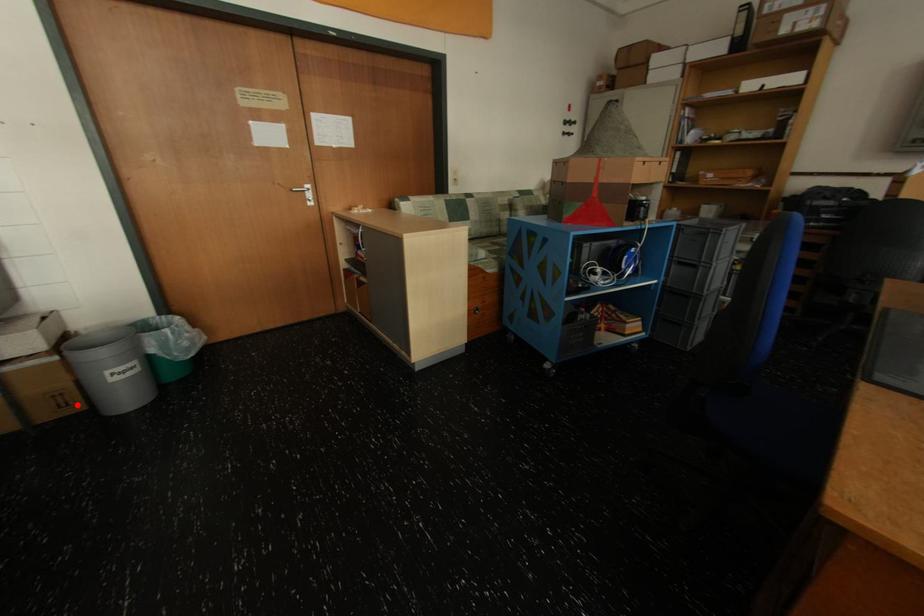
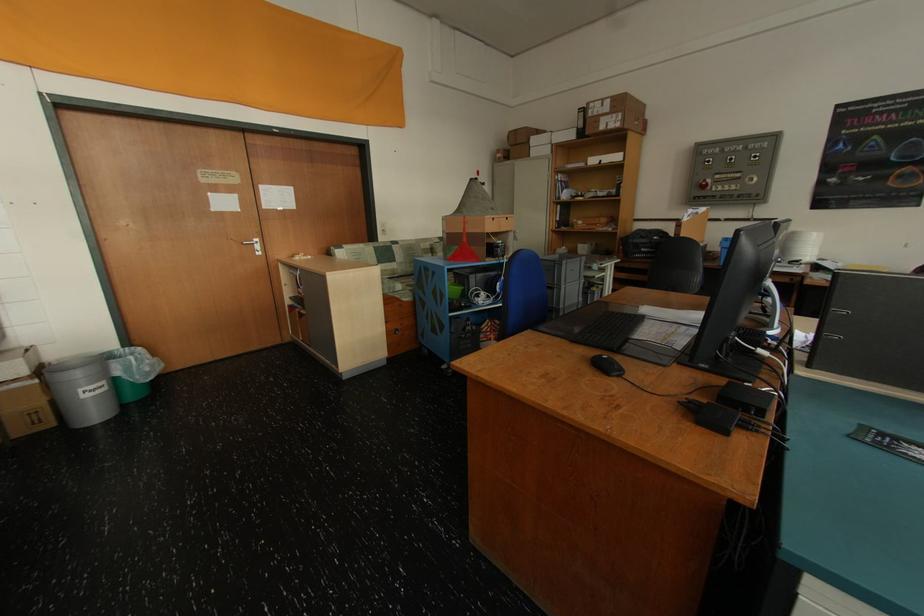
In the second image, find the point that corresponds to the highlighted location in the first image.

(50, 422)